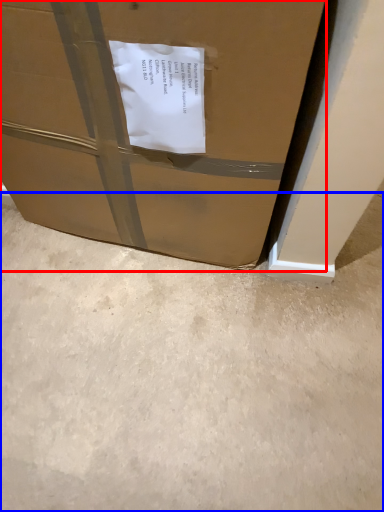
Question: Which object is closer to the camera taking this photo, box (highlighted by a red box) or concrete (highlighted by a blue box)?

Choices:
 (A) box
 (B) concrete

Answer: (A)